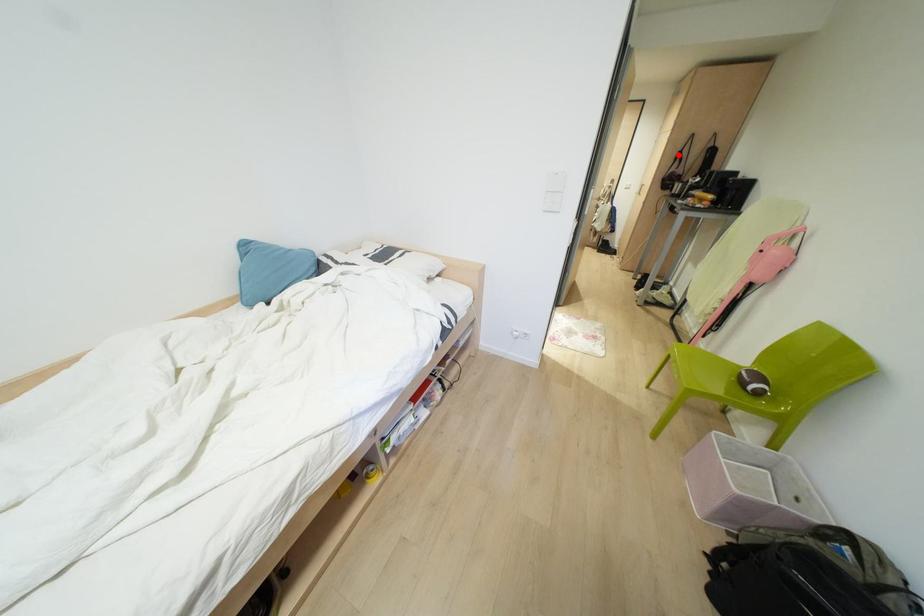
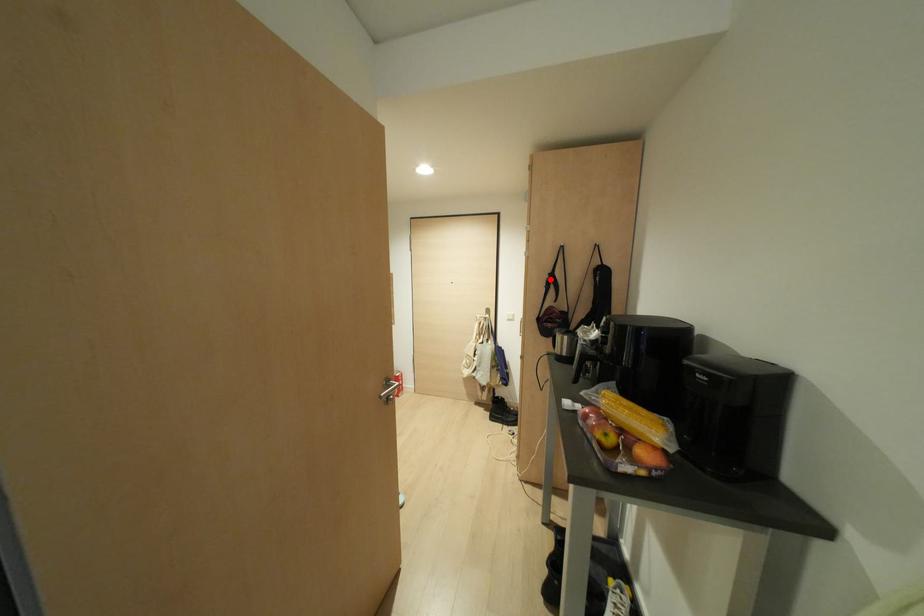
I am providing you with two images of the same scene from different viewpoints. A red point is marked on the first image and another point is marked on the second image. Do the highlighted points in image1 and image2 indicate the same real-world spot?

Yes